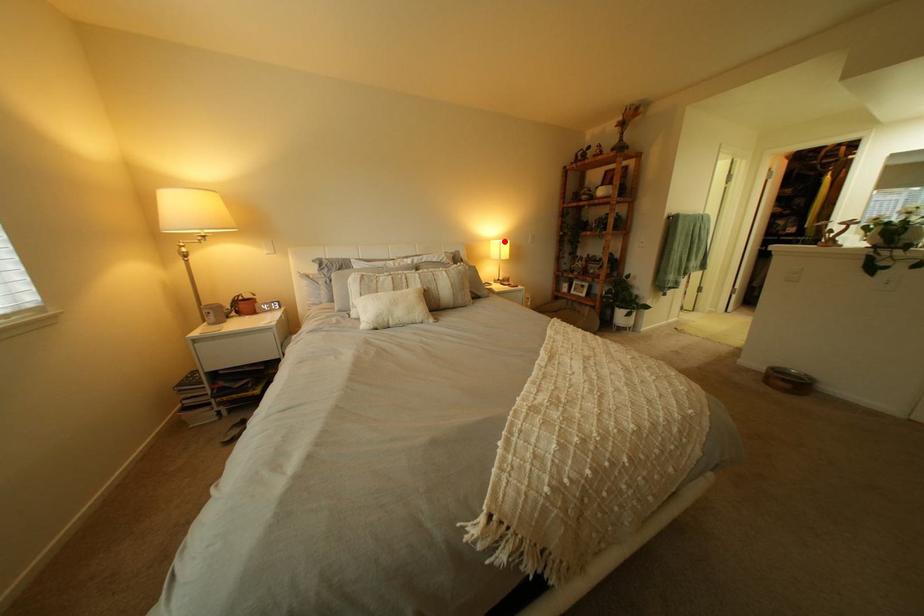
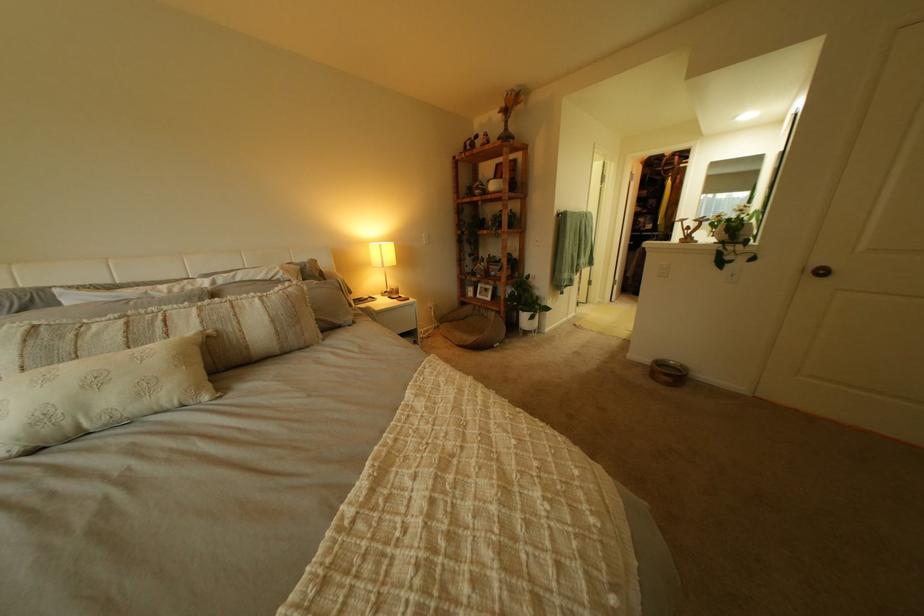
Locate, in the second image, the point that corresponds to the highlighted location in the first image.

(381, 244)